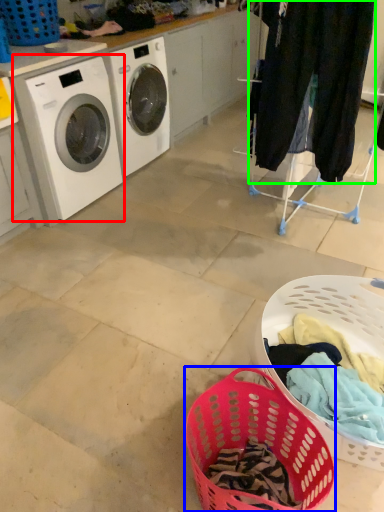
Question: Which object is the closest to the washing machine (highlighted by a red box)? Choose among these: basket (highlighted by a blue box) or clothing (highlighted by a green box).

Choices:
 (A) basket
 (B) clothing

Answer: (B)